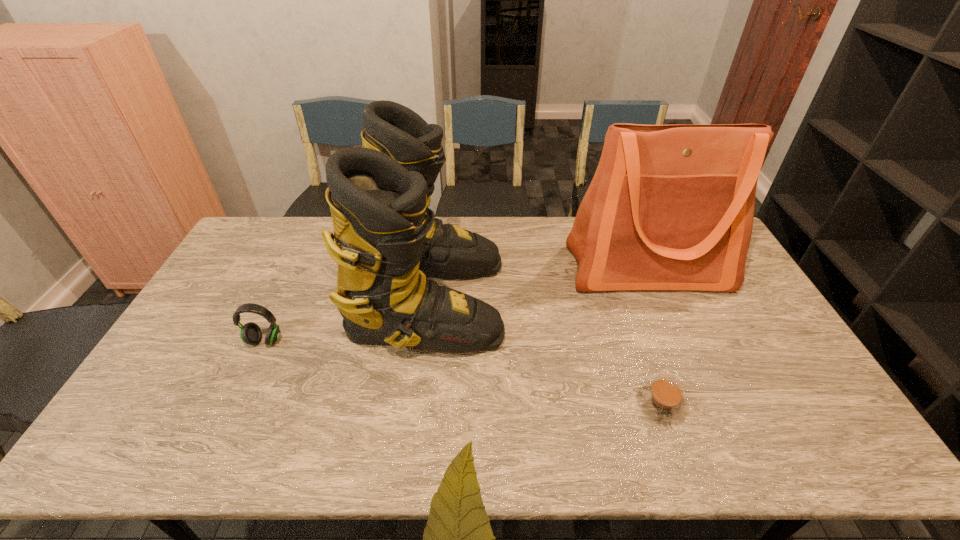
Find the location of a particular element. The image size is (960, 540). free point between the leftmost object and the shortest object is located at coordinates (463, 373).

Locate an element on the screen. Image resolution: width=960 pixels, height=540 pixels. free point between the shopping bag and the nearest object is located at coordinates (654, 336).

This screenshot has width=960, height=540. Find the location of `free point between the ski boots and the shopping bag`. free point between the ski boots and the shopping bag is located at coordinates (538, 285).

Where is `unoccupied area between the second object from left to right and the shopping bag`? Image resolution: width=960 pixels, height=540 pixels. unoccupied area between the second object from left to right and the shopping bag is located at coordinates (538, 285).

Where is `empty space between the shortest object and the headset`? This screenshot has height=540, width=960. empty space between the shortest object and the headset is located at coordinates pyautogui.click(x=463, y=373).

Where is `object that ranks as the closest to the cappuccino`? object that ranks as the closest to the cappuccino is located at coordinates (670, 207).

You are a GUI agent. You are given a task and a screenshot of the screen. Output one action in this format:
    pyautogui.click(x=<x>, y=<y>)
    Task: Click on the closest object to the cappuccino
    Image resolution: width=960 pixels, height=540 pixels.
    Given the screenshot: What is the action you would take?
    pyautogui.click(x=670, y=207)

The height and width of the screenshot is (540, 960). Find the location of `vacant position in the image that satisfies the following two spatial constraints: 1. on the ear cups of the shortest object; 2. on the right side of the second shortest object`. vacant position in the image that satisfies the following two spatial constraints: 1. on the ear cups of the shortest object; 2. on the right side of the second shortest object is located at coordinates (235, 404).

Identify the location of free space that satisfies the following two spatial constraints: 1. on the ear cups of the leftmost object; 2. on the left side of the cappuccino. This screenshot has height=540, width=960. (235, 404).